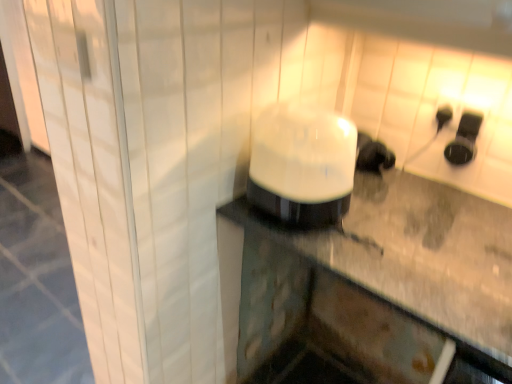
Question: Looking at their shapes, would you say black rubber earbuds at upper right, marked as the 2th appliance in a left-to-right arrangement, is wider or thinner than black plastic outlet at upper right?

Choices:
 (A) wide
 (B) thin

Answer: (A)

Question: From the image's perspective, is black rubber earbuds at upper right, marked as the 2th appliance in a left-to-right arrangement, above or below black plastic outlet at upper right?

Choices:
 (A) below
 (B) above

Answer: (A)

Question: Which object is positioned farthest from the black plastic outlet at upper right?

Choices:
 (A) black rubber earbuds at upper right, which appears as the 2th appliance when viewed from the front
 (B) white glossy humidifier at center, which is counted as the 1th appliance, starting from the front

Answer: (B)

Question: Which object is the farthest from the black plastic outlet at upper right?

Choices:
 (A) white glossy humidifier at center, marked as the first appliance in a left-to-right arrangement
 (B) black rubber earbuds at upper right, marked as the 2th appliance in a left-to-right arrangement

Answer: (A)